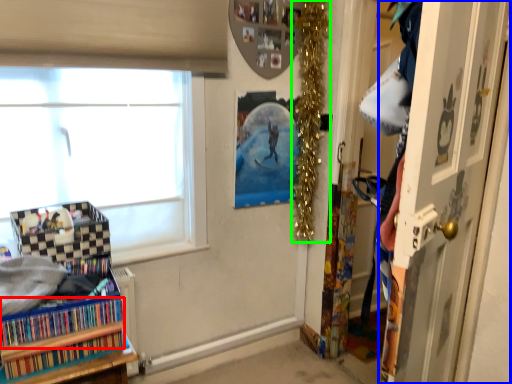
Question: Which is nearer to the book (highlighted by a red box)? door (highlighted by a blue box) or christmas decoration (highlighted by a green box).

Choices:
 (A) door
 (B) christmas decoration

Answer: (A)